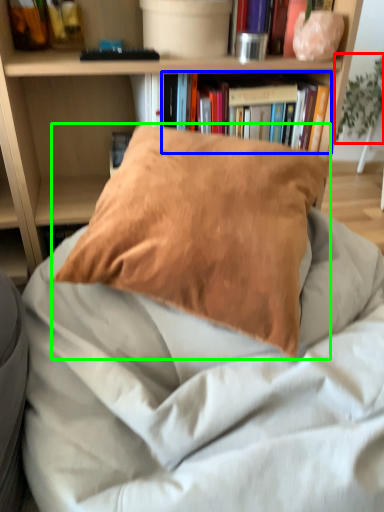
Question: Which is farther away from plant (highlighted by a red box)? book (highlighted by a blue box) or pillow (highlighted by a green box)?

Choices:
 (A) book
 (B) pillow

Answer: (B)